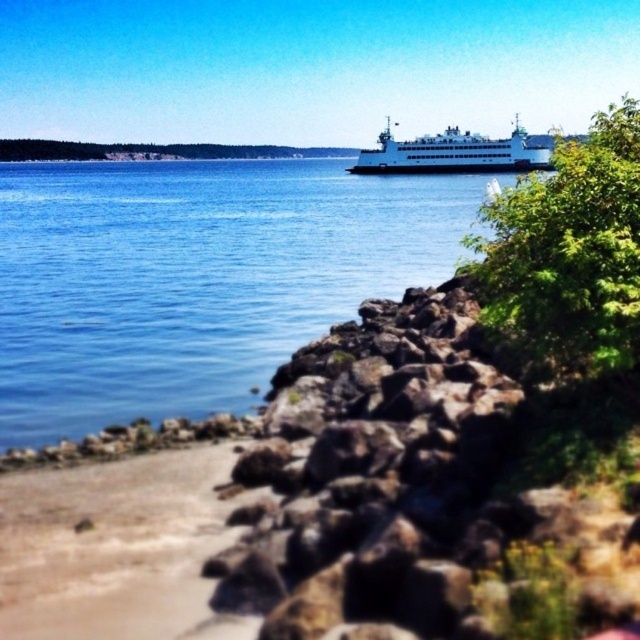
From the picture: Is blue water at center taller than sandy beach at lower left?

Yes, blue water at center is taller than sandy beach at lower left.

Can you confirm if blue water at center is thinner than sandy beach at lower left?

No, blue water at center is not thinner than sandy beach at lower left.

Locate an element on the screen. blue water at center is located at coordinates (196, 276).

Identify the location of blue water at center. The width and height of the screenshot is (640, 640). (196, 276).

Can you confirm if blue water at center is bigger than white matte ferry at upper center?

Indeed, blue water at center has a larger size compared to white matte ferry at upper center.

In the scene shown: Who is more distant from viewer, (99, 419) or (451, 166)?

Positioned behind is point (451, 166).

I want to click on blue water at center, so click(196, 276).

Can you confirm if blue water at center is positioned above green leafy tree at center right?

Correct, blue water at center is located above green leafy tree at center right.

Image resolution: width=640 pixels, height=640 pixels. What do you see at coordinates (196, 276) in the screenshot?
I see `blue water at center` at bounding box center [196, 276].

Is point (216, 369) farther from camera compared to point (554, 196)?

Yes, it is.

Find the location of a particular element. This screenshot has height=640, width=640. blue water at center is located at coordinates (196, 276).